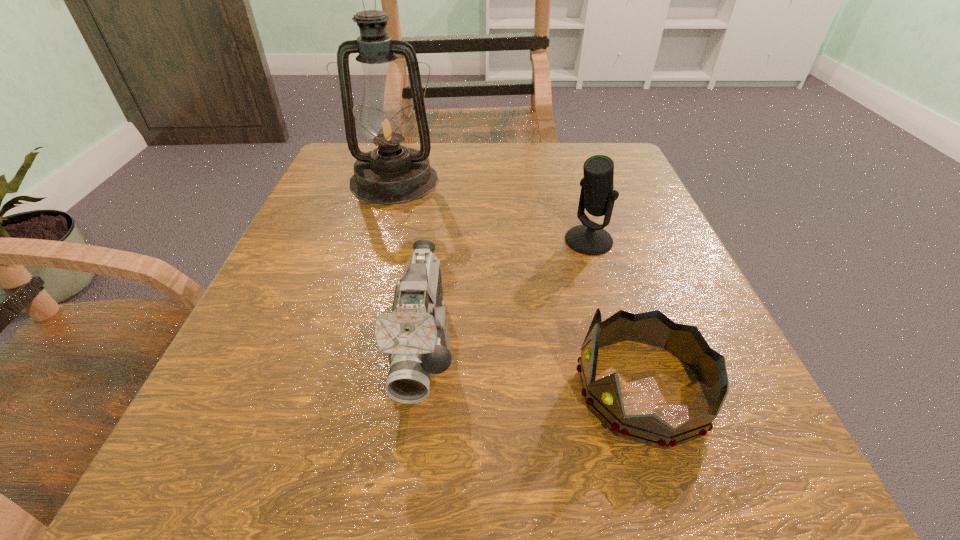
Locate an element on the screen. blank space located 0.300m at the front of the tiara with jewels is located at coordinates (335, 388).

I want to click on object present at the far edge, so click(x=390, y=174).

Locate an element on the screen. This screenshot has height=540, width=960. object situated at the near edge is located at coordinates (604, 397).

I want to click on object that is at the left edge, so click(390, 174).

Locate an element on the screen. The height and width of the screenshot is (540, 960). microphone that is at the right edge is located at coordinates (597, 196).

Find the location of a particular element. The image size is (960, 540). tiara that is at the right edge is located at coordinates (604, 397).

Where is `object present at the far left corner`? This screenshot has width=960, height=540. object present at the far left corner is located at coordinates (390, 174).

This screenshot has height=540, width=960. Find the location of `object that is at the near right corner`. object that is at the near right corner is located at coordinates (604, 397).

At what (x,y) coordinates should I click in order to perform the action: click on free location at the far edge of the desktop. Please return your answer as a coordinate pair (x, y). Looking at the image, I should click on (459, 193).

Locate an element on the screen. vacant area at the near edge is located at coordinates (529, 499).